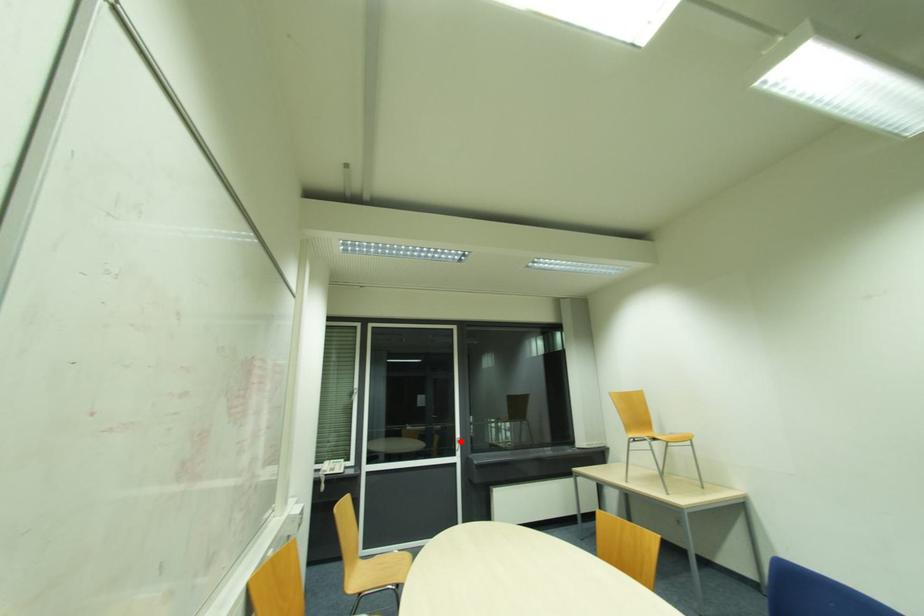
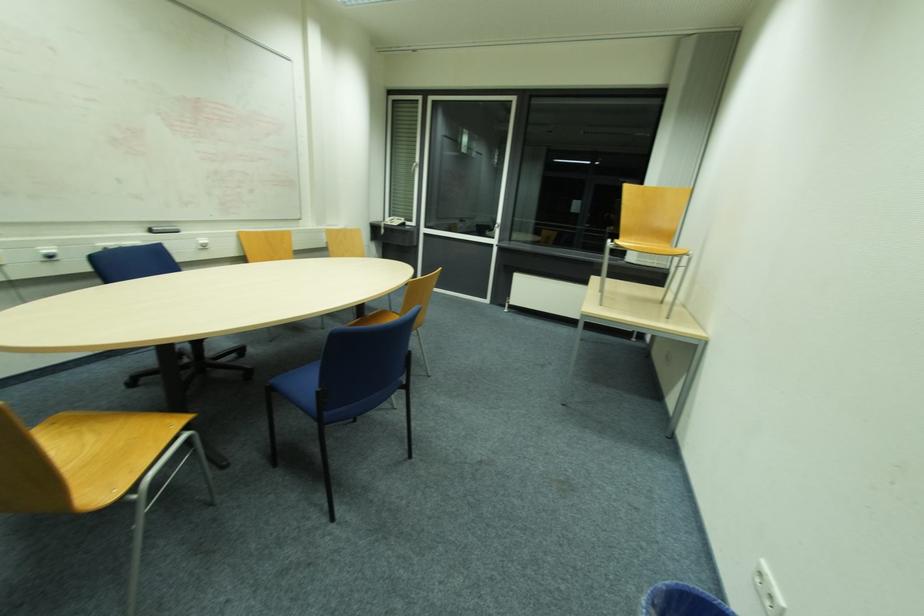
The point at the highlighted location is marked in the first image. Where is the corresponding point in the second image?

(497, 225)